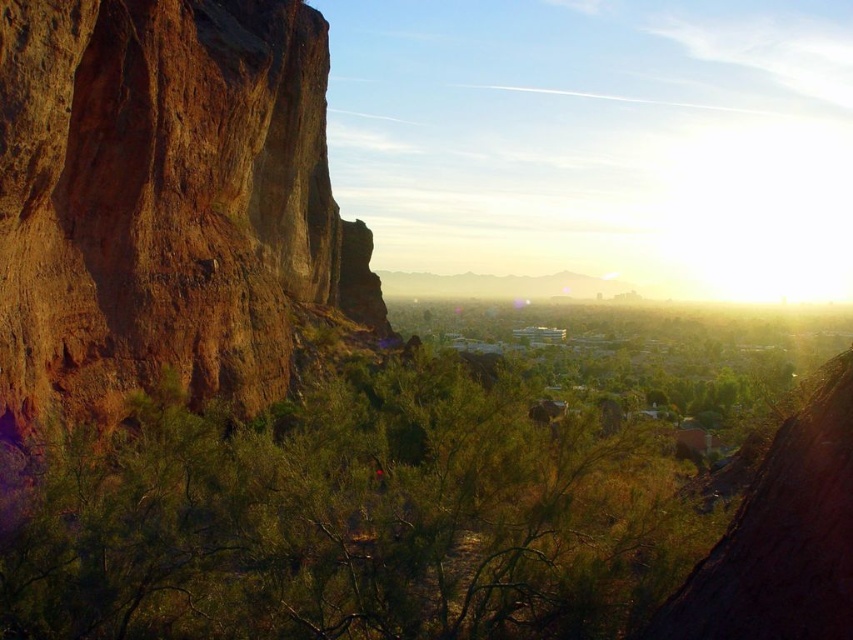
Is green leafy shrub at center wider than brown rough rock at left?

Correct, the width of green leafy shrub at center exceeds that of brown rough rock at left.

Does green leafy shrub at center have a larger size compared to brown rough rock at left?

Actually, green leafy shrub at center might be smaller than brown rough rock at left.

Does point (131, 438) lie in front of point (293, 17)?

That is True.

The image size is (853, 640). I want to click on green leafy shrub at center, so click(354, 518).